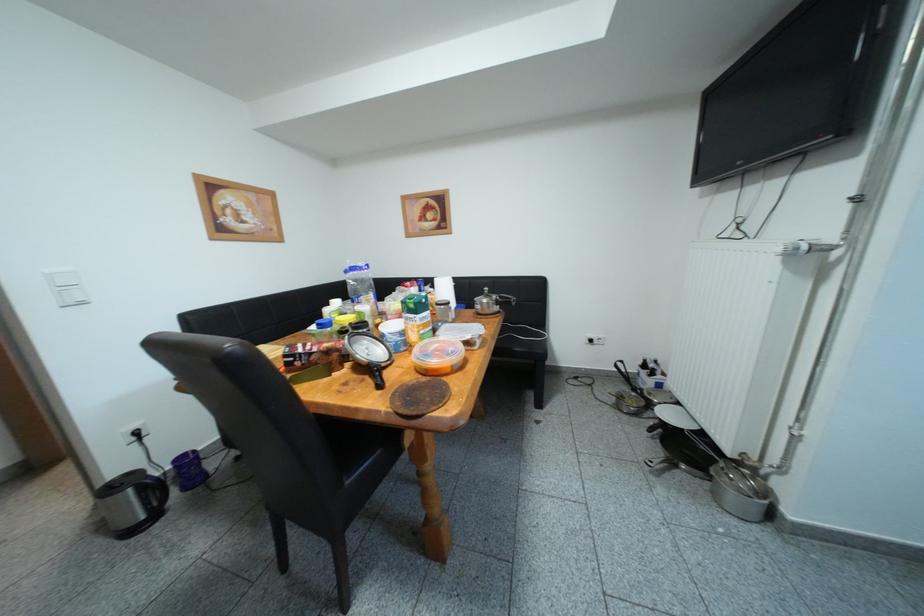
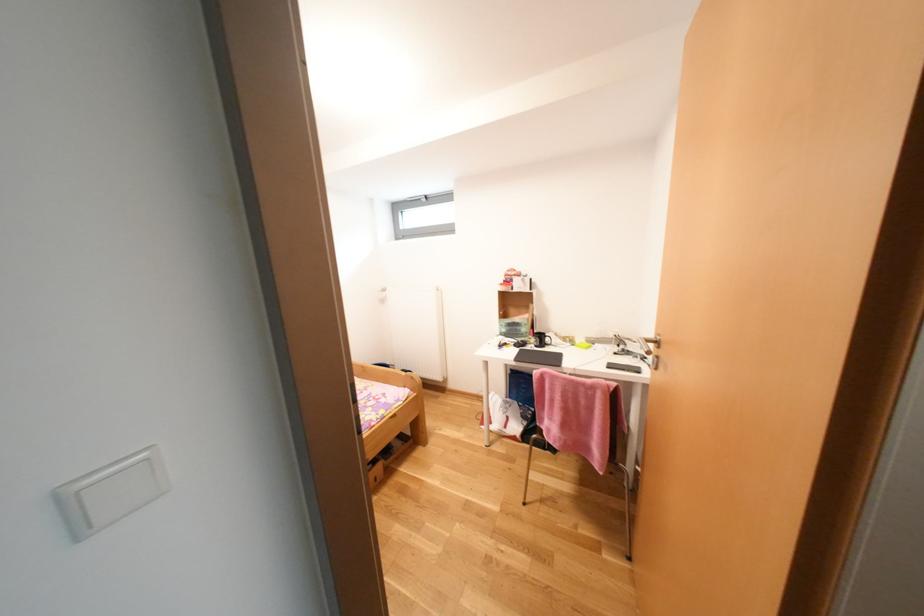
Question: Which direction would the cameraman need to move to produce the second image? Reply with the corresponding letter.

Choices:
 (A) Left
 (B) Right
 (C) Forward
 (D) Backward

Answer: (A)